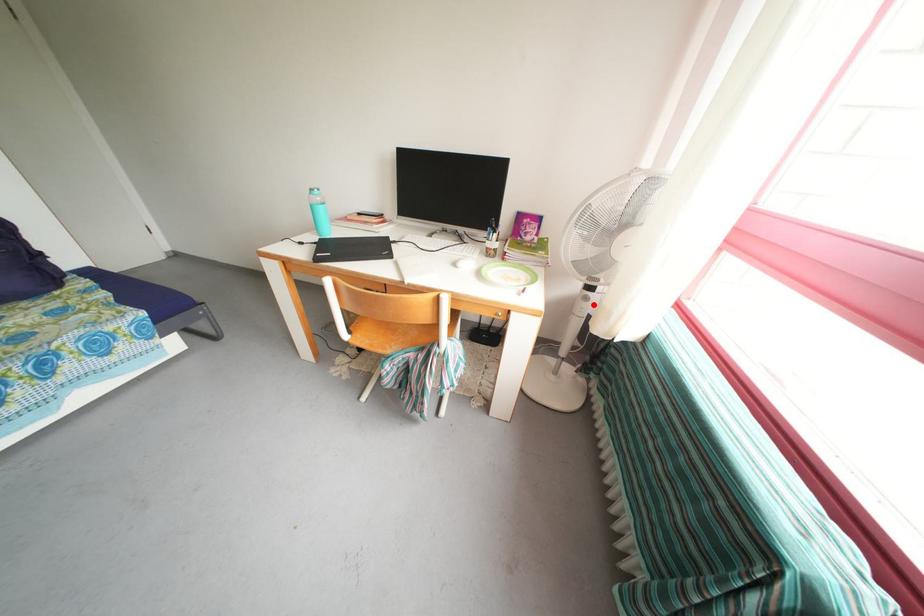
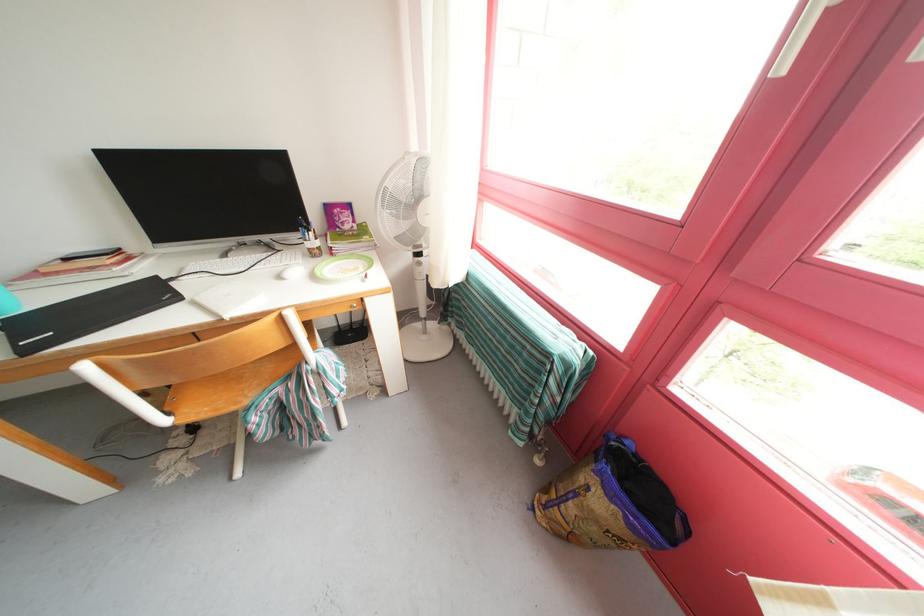
Question: A red point is marked in image1. In image2, is the corresponding 3D point closer to the camera or farther? Reply with the corresponding letter.

Choices:
 (A) The corresponding 3D point is closer.
 (B) The corresponding 3D point is farther.

Answer: (A)